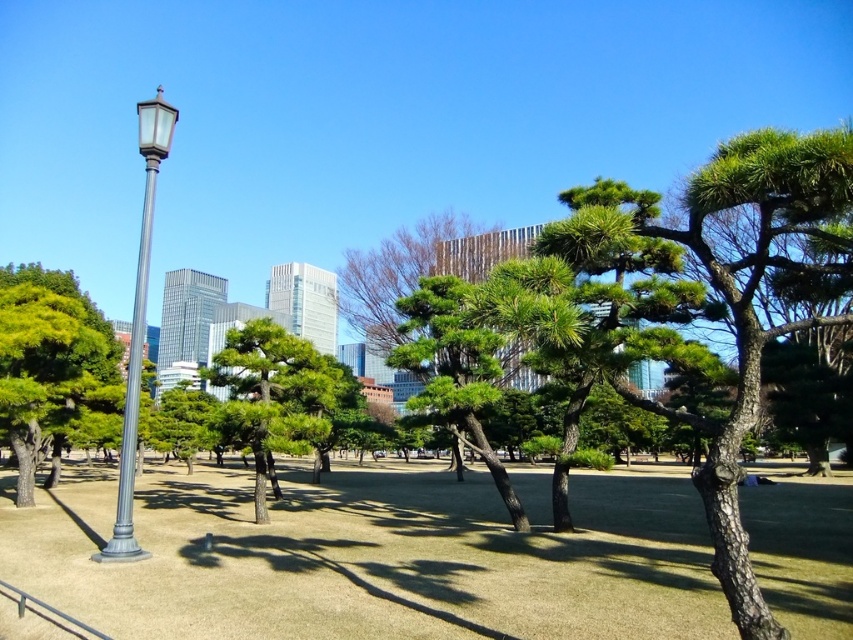
You are standing in the park and see a point marked at coordinates (51, 369). According to the image, which object does this point belong to?

The point at coordinates (51, 369) is on the green textured tree at left.